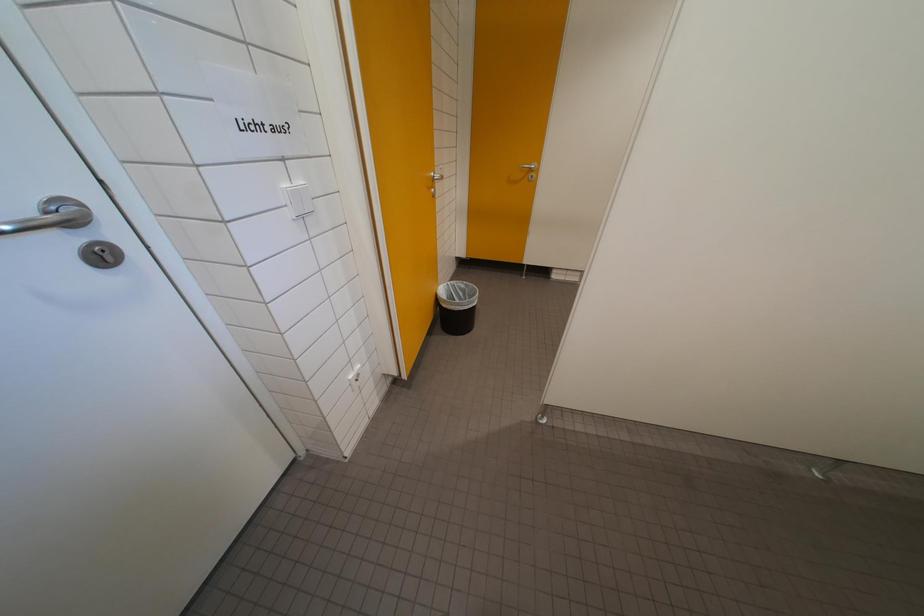
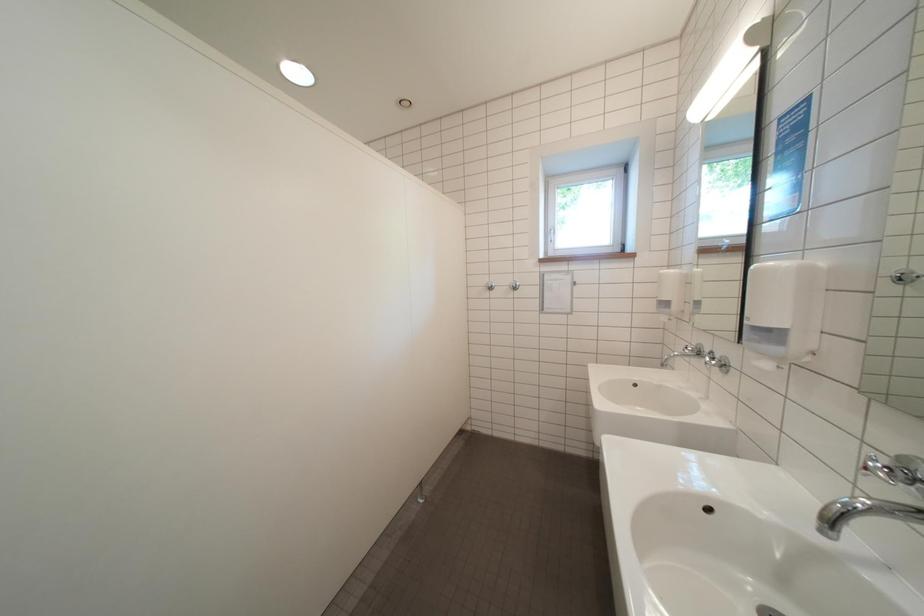
Question: The camera is either moving clockwise (left) or counter-clockwise (right) around the object. The first image is from the beginning of the video and the second image is from the end. Is the camera moving left or right when shooting the video?

Choices:
 (A) Left
 (B) Right

Answer: (A)